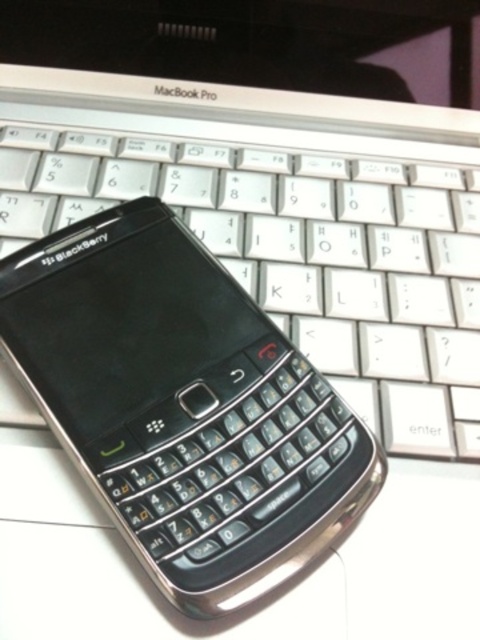
Question: Does black plastic smartphone at center appear on the left side of white plastic keyboard at center?

Choices:
 (A) yes
 (B) no

Answer: (A)

Question: Observing the image, what is the correct spatial positioning of black plastic smartphone at center in reference to white plastic keyboard at center?

Choices:
 (A) below
 (B) above

Answer: (A)

Question: Among these objects, which one is farthest from the camera?

Choices:
 (A) black plastic smartphone at center
 (B) white plastic keyboard at center

Answer: (B)

Question: Which point is closer to the camera?

Choices:
 (A) (52, 323)
 (B) (24, 216)

Answer: (A)

Question: Is black plastic smartphone at center further to camera compared to white plastic keyboard at center?

Choices:
 (A) yes
 (B) no

Answer: (B)